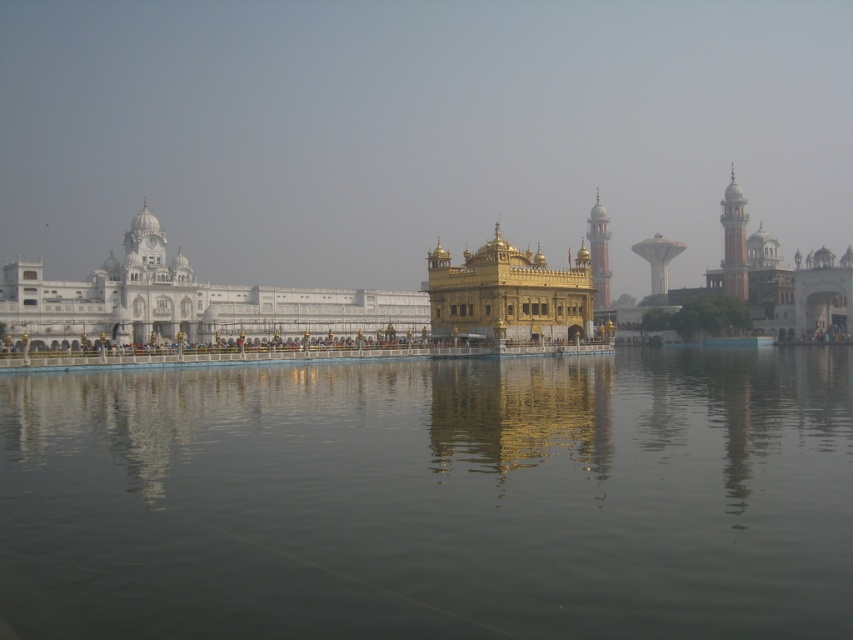
Who is more distant from viewer, (250, 368) or (106, 326)?

Point (106, 326)

Which is in front, point (846, 604) or point (509, 273)?

Positioned in front is point (846, 604).

Between point (287, 490) and point (67, 310), which one is positioned behind?

Positioned behind is point (67, 310).

The image size is (853, 640). I want to click on transparent water at center, so (434, 499).